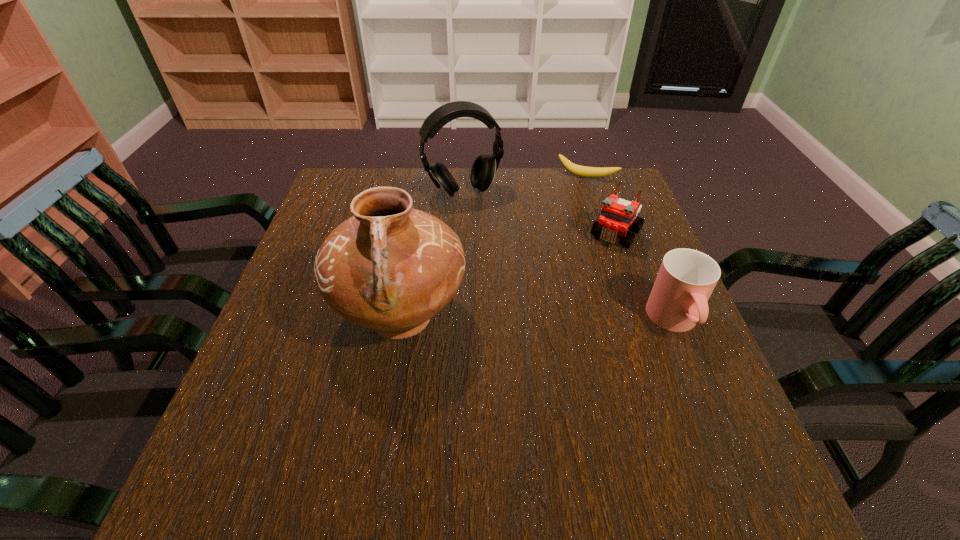
The image size is (960, 540). Find the location of `pottery`. pottery is located at coordinates (391, 268).

Image resolution: width=960 pixels, height=540 pixels. In order to click on cup in this screenshot , I will do `click(678, 301)`.

You are a GUI agent. You are given a task and a screenshot of the screen. Output one action in this format:
    pyautogui.click(x=<x>, y=<y>)
    Task: Click on the Lego
    The image size is (960, 540).
    Given the screenshot: What is the action you would take?
    pyautogui.click(x=617, y=215)

Image resolution: width=960 pixels, height=540 pixels. What are the coordinates of `the shortest object` in the screenshot? It's located at pos(583,171).

In order to click on earphone in this screenshot , I will do `click(484, 167)`.

This screenshot has height=540, width=960. I want to click on vacant space located 0.080m on the side of the pottery with the handle, so click(386, 411).

This screenshot has width=960, height=540. What are the coordinates of `free region located 0.070m on the side of the cup with the handle` in the screenshot? It's located at [700, 381].

In order to click on vacant space located on the front-facing side of the Lego in this screenshot , I will do `click(584, 281)`.

This screenshot has height=540, width=960. Find the location of `vacant area situated 0.090m on the front-facing side of the Lego`. vacant area situated 0.090m on the front-facing side of the Lego is located at coordinates (592, 269).

The height and width of the screenshot is (540, 960). Identify the location of blank area located on the front-facing side of the Lego. (592, 269).